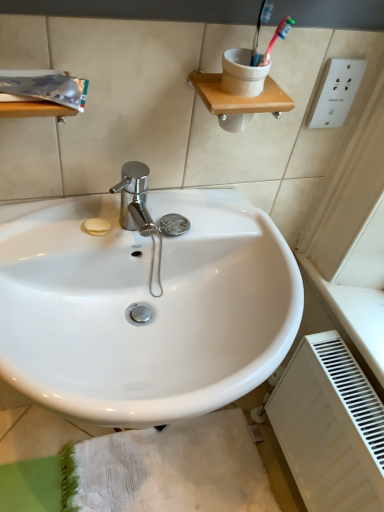
Question: From a real-world perspective, is white matte radiator at lower right on white glossy sink at center?

Choices:
 (A) no
 (B) yes

Answer: (A)

Question: Can you confirm if white matte radiator at lower right is taller than white glossy sink at center?

Choices:
 (A) no
 (B) yes

Answer: (B)

Question: Is white matte radiator at lower right thinner than white glossy sink at center?

Choices:
 (A) no
 (B) yes

Answer: (B)

Question: Is white matte radiator at lower right closer to the viewer compared to white glossy sink at center?

Choices:
 (A) no
 (B) yes

Answer: (A)

Question: Does white matte radiator at lower right have a greater width compared to white glossy sink at center?

Choices:
 (A) yes
 (B) no

Answer: (B)

Question: Is white glossy sink at center inside the boundaries of white matte radiator at lower right, or outside?

Choices:
 (A) inside
 (B) outside

Answer: (B)

Question: Considering the positions of white glossy sink at center and white matte radiator at lower right in the image, is white glossy sink at center wider or thinner than white matte radiator at lower right?

Choices:
 (A) thin
 (B) wide

Answer: (B)

Question: Based on their sizes in the image, would you say white glossy sink at center is bigger or smaller than white matte radiator at lower right?

Choices:
 (A) small
 (B) big

Answer: (B)

Question: From the image's perspective, is white glossy sink at center located above or below white matte radiator at lower right?

Choices:
 (A) above
 (B) below

Answer: (A)

Question: In terms of width, does white textured bath mat at lower center look wider or thinner when compared to white matte radiator at lower right?

Choices:
 (A) thin
 (B) wide

Answer: (B)

Question: Would you say white textured bath mat at lower center is to the left or to the right of white matte radiator at lower right in the picture?

Choices:
 (A) left
 (B) right

Answer: (A)

Question: From a real-world perspective, is white textured bath mat at lower center physically located above or below white matte radiator at lower right?

Choices:
 (A) above
 (B) below

Answer: (B)

Question: Is point (99, 466) positioned closer to the camera than point (322, 345)?

Choices:
 (A) farther
 (B) closer

Answer: (A)

Question: In terms of height, does white textured bath mat at lower center look taller or shorter compared to white glossy sink at center?

Choices:
 (A) short
 (B) tall

Answer: (A)

Question: In the image, is white textured bath mat at lower center on the left side or the right side of white glossy sink at center?

Choices:
 (A) left
 (B) right

Answer: (B)